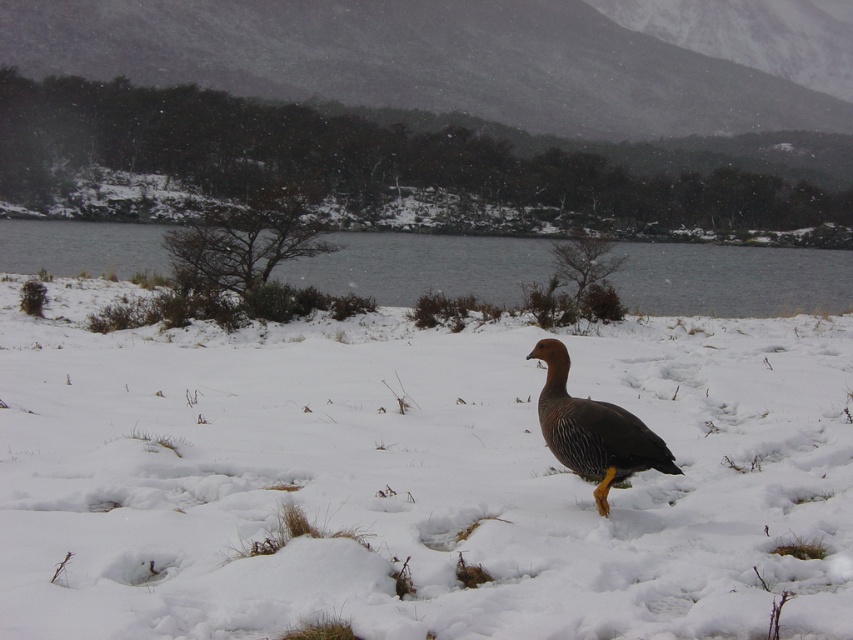
Locate an element on the screen. The height and width of the screenshot is (640, 853). gray water at center is located at coordinates pyautogui.click(x=732, y=280).

Is gray water at center below brown feathered duck at center?

Actually, gray water at center is above brown feathered duck at center.

Who is more forward, (711, 248) or (554, 404)?

Point (554, 404) is in front.

Identify the location of gray water at center. The width and height of the screenshot is (853, 640). (732, 280).

Does white fluffy snow at center lie in front of brown feathered duck at center?

Yes, it is in front of brown feathered duck at center.

Can you confirm if white fluffy snow at center is positioned to the left of brown feathered duck at center?

Indeed, white fluffy snow at center is positioned on the left side of brown feathered duck at center.

You are a GUI agent. You are given a task and a screenshot of the screen. Output one action in this format:
    pyautogui.click(x=<x>, y=<y>)
    Task: Click on the white fluffy snow at center
    The image size is (853, 640).
    Given the screenshot: What is the action you would take?
    click(415, 477)

Does white fluffy snow at center have a lesser height compared to gray water at center?

Indeed, white fluffy snow at center has a lesser height compared to gray water at center.

Is white fluffy snow at center to the left of gray water at center from the viewer's perspective?

Indeed, white fluffy snow at center is positioned on the left side of gray water at center.

The height and width of the screenshot is (640, 853). Describe the element at coordinates (415, 477) in the screenshot. I see `white fluffy snow at center` at that location.

At what (x,y) coordinates should I click in order to perform the action: click on white fluffy snow at center. Please return your answer as a coordinate pair (x, y). Looking at the image, I should click on (415, 477).